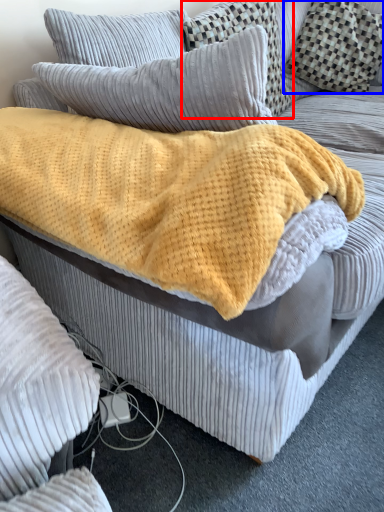
Question: Which point is further to the camera, pillow (highlighted by a red box) or pillow (highlighted by a blue box)?

Choices:
 (A) pillow
 (B) pillow

Answer: (B)